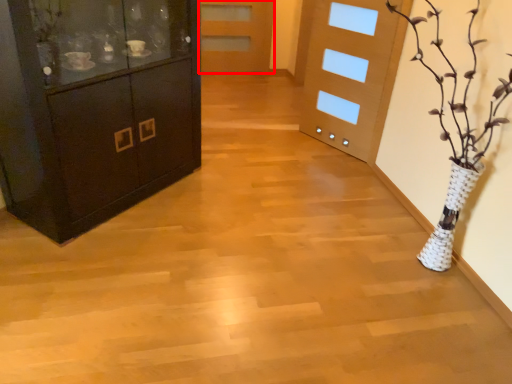
Question: From the image's perspective, what is the correct spatial positioning of door (annotated by the red box) in reference to cabinetry?

Choices:
 (A) below
 (B) above

Answer: (B)